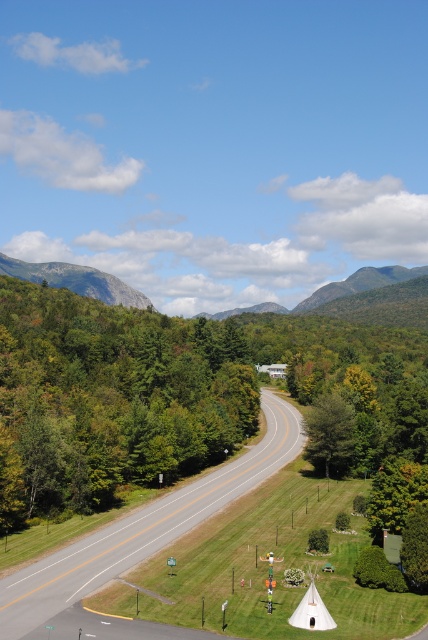
You are a hiker planning a route through the valley. You see the asphalt road at center and the gray rock formation at upper left. Which one is farther from your current position?

The asphalt road at center is 1290.48 feet away from the gray rock formation at upper left. Since the question asks which is farther from your current position, the answer depends on your location. However, based on the given information, the distance between them is 1290.48 feet, so neither is inherently farther unless your position is specified.

You are a hiker planning to take a photo of the green leafy tree at left and the asphalt road at center from a position along the winding road. Considering their sizes, which object should appear bigger in your photo?

The green leafy tree at left should appear bigger in the photo since it has a larger size compared to the asphalt road at center.